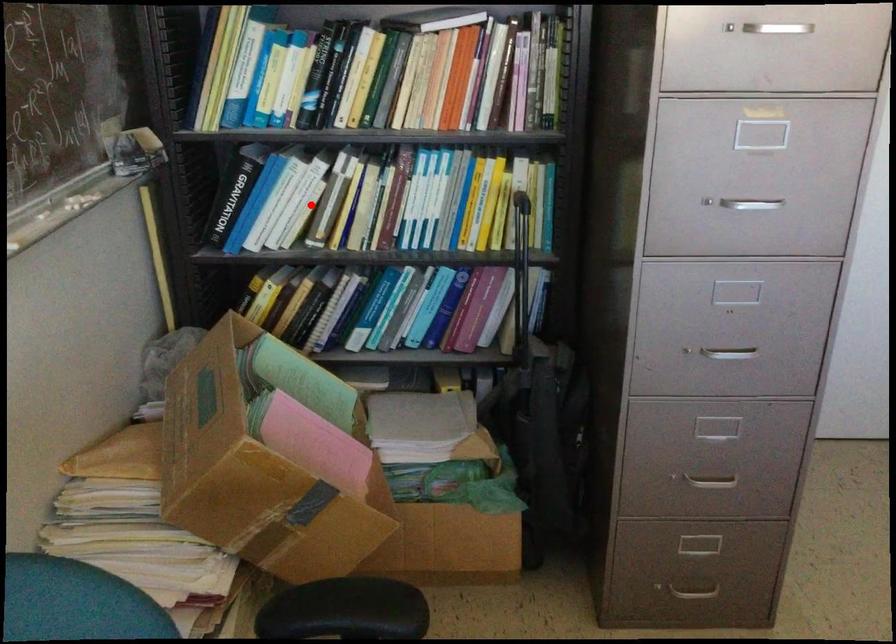
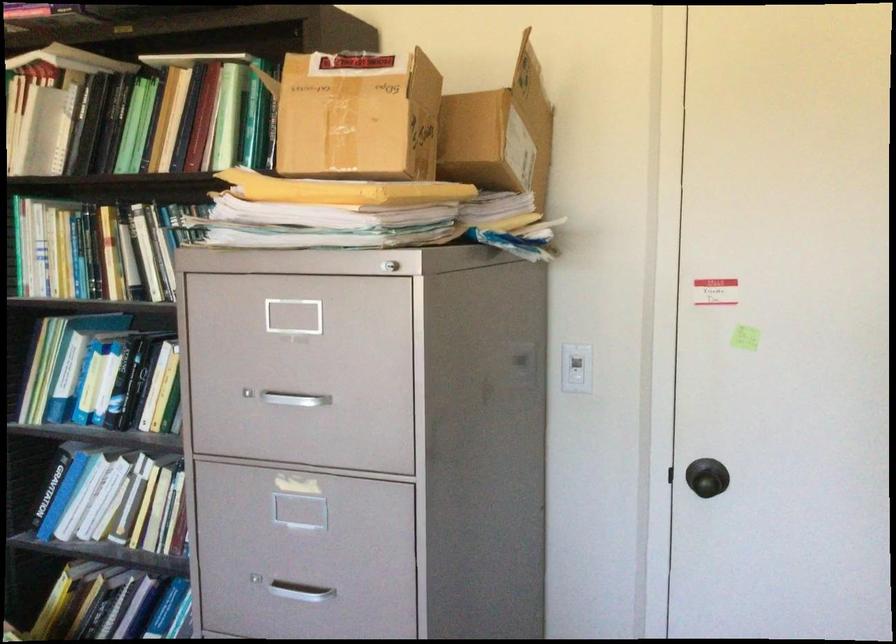
The point at the highlighted location is marked in the first image. Where is the corresponding point in the second image?

(117, 502)